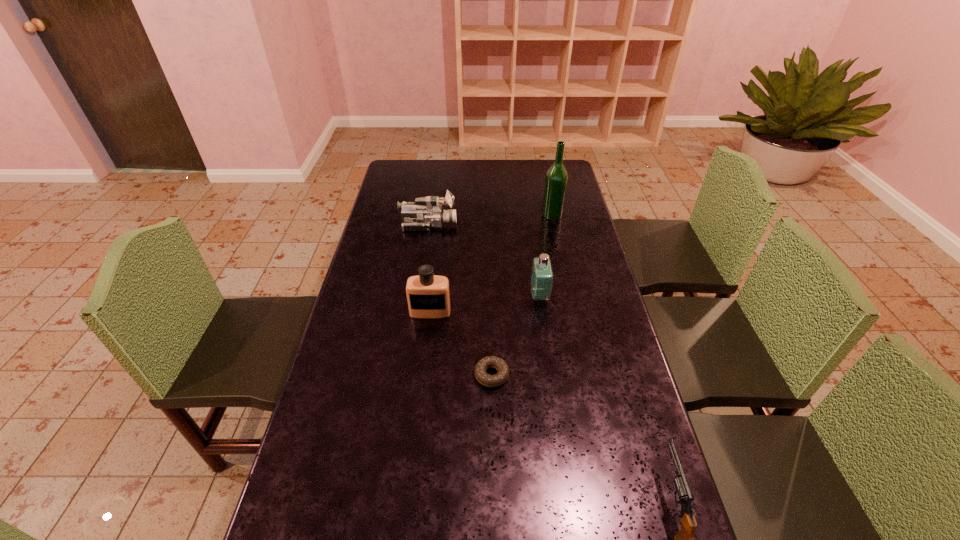
The height and width of the screenshot is (540, 960). I want to click on the fifth object from left to right, so click(556, 179).

Find the location of a particular element. the tallest object is located at coordinates (556, 179).

The height and width of the screenshot is (540, 960). In order to click on the left perfume in this screenshot , I will do `click(428, 296)`.

Where is `the right perfume`? Image resolution: width=960 pixels, height=540 pixels. the right perfume is located at coordinates (542, 274).

The width and height of the screenshot is (960, 540). I want to click on camcorder, so click(427, 212).

This screenshot has width=960, height=540. What are the coordinates of `the fifth farthest object` in the screenshot? It's located at (500, 365).

Where is `the fourth object from right to left`? the fourth object from right to left is located at coordinates pos(500,365).

Locate an element on the screen. This screenshot has width=960, height=540. vacant area situated on the back of the fifth object from left to right is located at coordinates (540, 162).

This screenshot has height=540, width=960. I want to click on free space located on the front label of the left perfume, so click(x=415, y=443).

Identify the location of vacant space situated on the front label of the fourth object from left to right. The width and height of the screenshot is (960, 540). (431, 295).